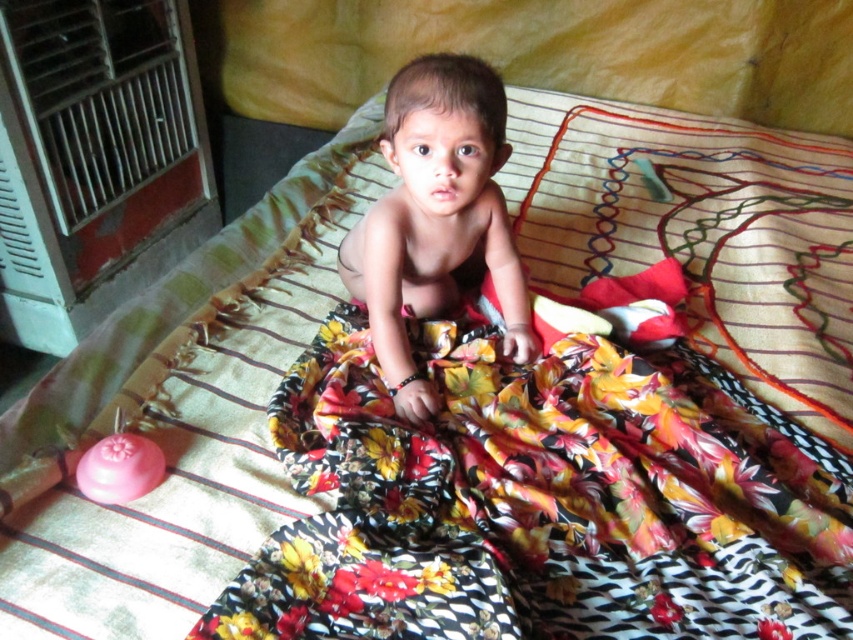
Based on the scene description, which object is taller between the floral fabric blanket at center and the smooth skin baby at center?

The smooth skin baby at center is taller than the floral fabric blanket at center.

You are a photographer taking a picture of the smooth skin baby at center and the floral fabric blanket at center. Based on their positions, which object is closer to the right edge of the image?

The floral fabric blanket at center is to the right of the smooth skin baby at center, so the floral fabric blanket at center is closer to the right edge of the image.

You are a caregiver who needs to ensure the smooth skin baby at center is fully covered by the floral fabric blanket at center. Based on the scene, can the blanket cover the baby completely?

The floral fabric blanket at center is larger in size than smooth skin baby at center, so yes, the blanket can fully cover the baby.